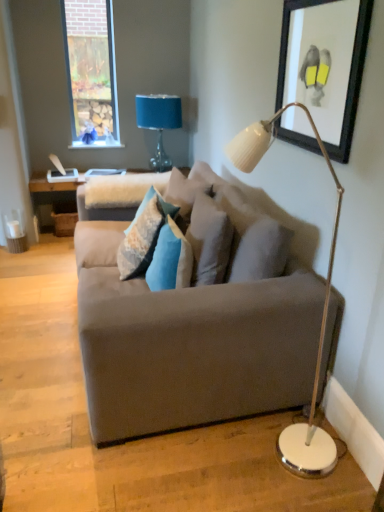
Question: Is white glossy floor lamp at right at the right side of textured blue pillow at center, which ranks as the third pillow in right-to-left order?

Choices:
 (A) yes
 (B) no

Answer: (A)

Question: Is white glossy floor lamp at right smaller than textured blue pillow at center, which ranks as the third pillow in right-to-left order?

Choices:
 (A) no
 (B) yes

Answer: (A)

Question: Is white glossy floor lamp at right oriented away from textured blue pillow at center, which ranks as the third pillow in right-to-left order?

Choices:
 (A) no
 (B) yes

Answer: (A)

Question: From a real-world perspective, is white glossy floor lamp at right beneath textured blue pillow at center, the 1th pillow when ordered from left to right?

Choices:
 (A) no
 (B) yes

Answer: (A)

Question: Is white glossy floor lamp at right positioned in front of textured blue pillow at center, the 1th pillow when ordered from left to right?

Choices:
 (A) yes
 (B) no

Answer: (A)

Question: Is point (291, 467) closer or farther from the camera than point (135, 117)?

Choices:
 (A) farther
 (B) closer

Answer: (B)

Question: In terms of height, does white glossy floor lamp at right look taller or shorter compared to blue fabric lampshade at upper center?

Choices:
 (A) short
 (B) tall

Answer: (B)

Question: Relative to blue fabric lampshade at upper center, is white glossy floor lamp at right in front or behind?

Choices:
 (A) behind
 (B) front

Answer: (B)

Question: Is white glossy floor lamp at right wider or thinner than blue fabric lampshade at upper center?

Choices:
 (A) wide
 (B) thin

Answer: (A)

Question: Is point (203, 252) closer or farther from the camera than point (142, 250)?

Choices:
 (A) farther
 (B) closer

Answer: (B)

Question: Based on their positions, is textured gray pillow at center, the first pillow in the right-to-left sequence, located to the left or right of textured blue pillow at center, which ranks as the third pillow in right-to-left order?

Choices:
 (A) right
 (B) left

Answer: (A)

Question: From a real-world perspective, is textured gray pillow at center, the first pillow in the right-to-left sequence, physically located above or below textured blue pillow at center, the 1th pillow when ordered from left to right?

Choices:
 (A) below
 (B) above

Answer: (B)

Question: In the image, is textured gray pillow at center, which appears as the 3th pillow when viewed from the left, positioned in front of or behind textured blue pillow at center, the 1th pillow when ordered from left to right?

Choices:
 (A) front
 (B) behind

Answer: (A)

Question: From a real-world perspective, is black matte picture frame at upper right positioned above or below textured blue pillow at center, which ranks as the third pillow in right-to-left order?

Choices:
 (A) above
 (B) below

Answer: (A)

Question: Visually, is black matte picture frame at upper right positioned to the left or to the right of textured blue pillow at center, which ranks as the third pillow in right-to-left order?

Choices:
 (A) right
 (B) left

Answer: (A)